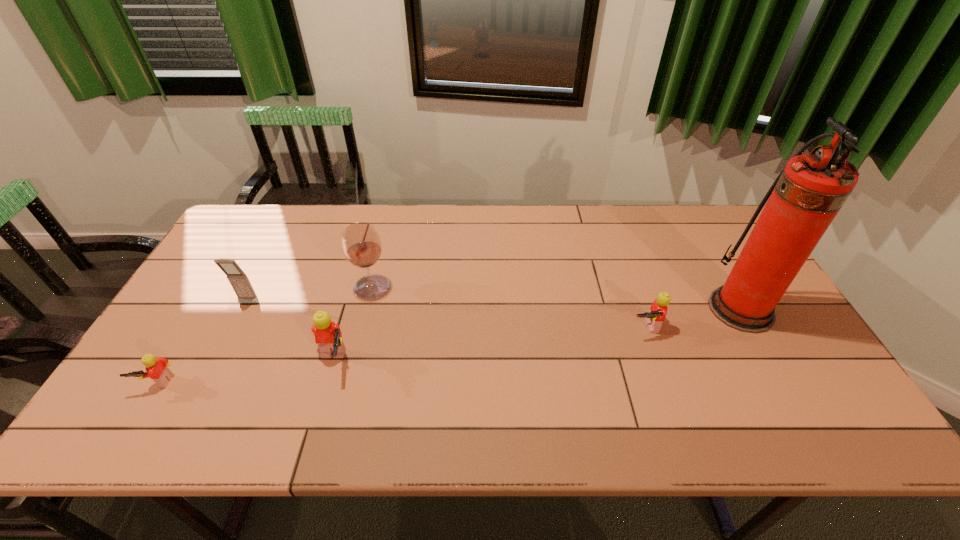
Find the location of a particular element. free region located 0.080m in front of the third shortest object with the accessory visible is located at coordinates (383, 362).

This screenshot has height=540, width=960. What are the coordinates of `vacant region located in front of the fifth object from left to right with the accessory visible` in the screenshot? It's located at (653, 354).

The height and width of the screenshot is (540, 960). Find the location of `vacant region located 0.140m at the discharge end of the rightmost object`. vacant region located 0.140m at the discharge end of the rightmost object is located at coordinates (660, 309).

Locate an element on the screen. The width and height of the screenshot is (960, 540). free space located 0.200m at the discharge end of the rightmost object is located at coordinates (638, 309).

You are a GUI agent. You are given a task and a screenshot of the screen. Output one action in this format:
    pyautogui.click(x=<x>, y=<y>)
    Task: Click on the free point located at the discharge end of the rightmost object
    Image resolution: width=960 pixels, height=540 pixels.
    Given the screenshot: What is the action you would take?
    627,309

The image size is (960, 540). What are the coordinates of `vacant space situated on the front-facing side of the second object from left to right` in the screenshot? It's located at (206, 388).

The width and height of the screenshot is (960, 540). I want to click on vacant space located 0.270m on the front of the wineglass, so click(348, 382).

You are a GUI agent. You are given a task and a screenshot of the screen. Output one action in this format:
    pyautogui.click(x=<x>, y=<y>)
    Task: Click on the Lego located in the left edge section of the desktop
    The image size is (960, 540).
    Given the screenshot: What is the action you would take?
    pyautogui.click(x=157, y=370)

Where is `cellular telephone at the left edge`? This screenshot has width=960, height=540. cellular telephone at the left edge is located at coordinates (239, 281).

The width and height of the screenshot is (960, 540). What are the coordinates of `object situated at the right edge` in the screenshot? It's located at (806, 196).